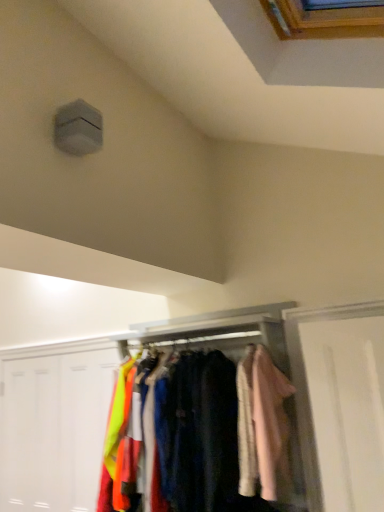
Question: From the image's perspective, would you say neon yellow fabric at lower left, placed as the first door when sorted from right to left, is positioned over light pink fabric coat at right?

Choices:
 (A) no
 (B) yes

Answer: (A)

Question: Considering the relative sizes of neon yellow fabric at lower left, placed as the first door when sorted from right to left, and light pink fabric coat at right in the image provided, is neon yellow fabric at lower left, placed as the first door when sorted from right to left, taller than light pink fabric coat at right?

Choices:
 (A) yes
 (B) no

Answer: (A)

Question: Can you confirm if neon yellow fabric at lower left, marked as the second door in a left-to-right arrangement, is positioned to the left of light pink fabric coat at right?

Choices:
 (A) yes
 (B) no

Answer: (A)

Question: Does neon yellow fabric at lower left, placed as the first door when sorted from right to left, have a lesser height compared to light pink fabric coat at right?

Choices:
 (A) yes
 (B) no

Answer: (B)

Question: Can you confirm if neon yellow fabric at lower left, marked as the second door in a left-to-right arrangement, is positioned to the right of light pink fabric coat at right?

Choices:
 (A) yes
 (B) no

Answer: (B)

Question: Is neon yellow fabric at lower left, marked as the second door in a left-to-right arrangement, positioned before light pink fabric coat at right?

Choices:
 (A) yes
 (B) no

Answer: (B)

Question: Is velvet fabric shirts at center wider than neon yellow fabric at lower left, placed as the first door when sorted from right to left?

Choices:
 (A) yes
 (B) no

Answer: (A)

Question: Can you confirm if velvet fabric shirts at center is taller than neon yellow fabric at lower left, marked as the second door in a left-to-right arrangement?

Choices:
 (A) no
 (B) yes

Answer: (A)

Question: From a real-world perspective, does velvet fabric shirts at center sit lower than neon yellow fabric at lower left, placed as the first door when sorted from right to left?

Choices:
 (A) no
 (B) yes

Answer: (A)

Question: Would you say velvet fabric shirts at center contains neon yellow fabric at lower left, marked as the second door in a left-to-right arrangement?

Choices:
 (A) yes
 (B) no

Answer: (B)

Question: Is the position of velvet fabric shirts at center less distant than that of neon yellow fabric at lower left, placed as the first door when sorted from right to left?

Choices:
 (A) yes
 (B) no

Answer: (A)

Question: From the image's perspective, is velvet fabric shirts at center on top of neon yellow fabric at lower left, placed as the first door when sorted from right to left?

Choices:
 (A) no
 (B) yes

Answer: (B)

Question: From the image's perspective, would you say light pink fabric coat at right is shown under neon yellow fabric at lower left, placed as the first door when sorted from right to left?

Choices:
 (A) yes
 (B) no

Answer: (B)